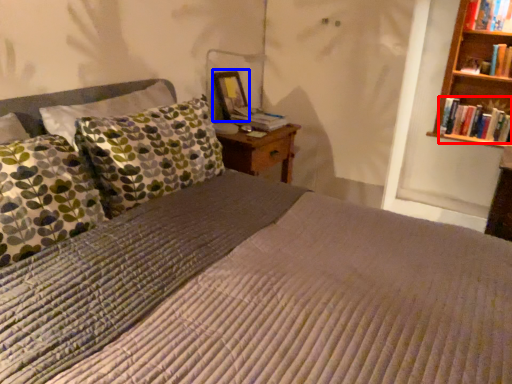
Question: Which point is further to the camera, book (highlighted by a red box) or picture frame (highlighted by a blue box)?

Choices:
 (A) book
 (B) picture frame

Answer: (A)